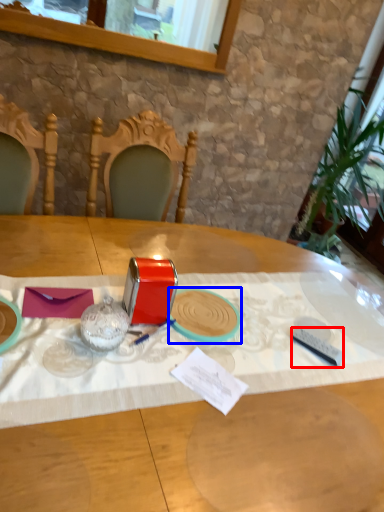
Question: Which object is closer to the camera taking this photo, tableware (highlighted by a red box) or tableware (highlighted by a blue box)?

Choices:
 (A) tableware
 (B) tableware

Answer: (B)